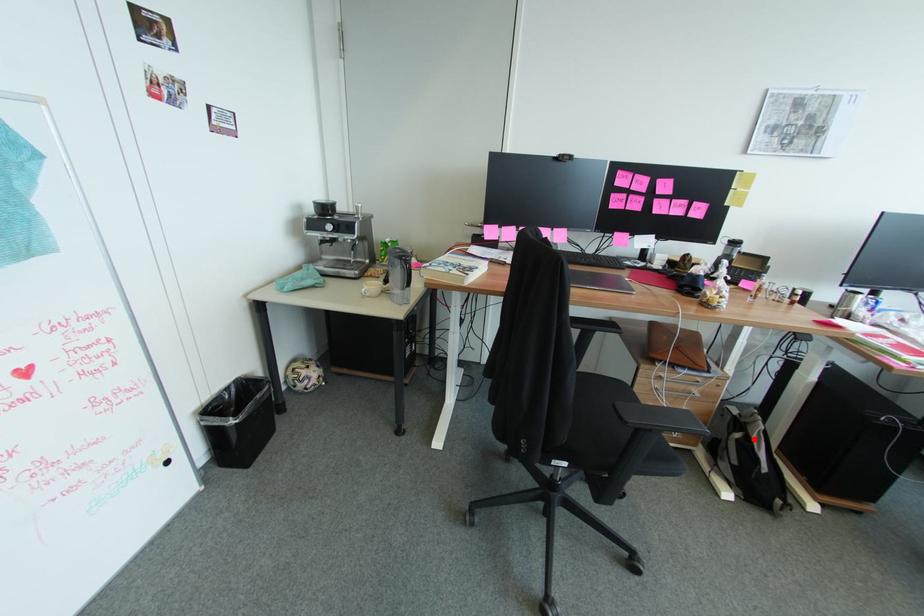
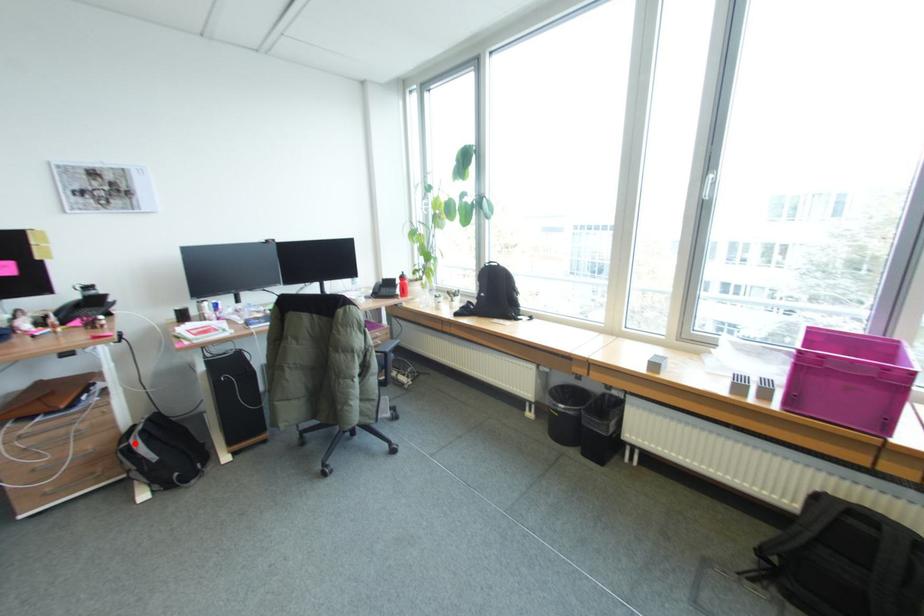
I am providing you with two images of the same scene from different viewpoints. A red point is marked on the first image and another point is marked on the second image. Is the marked point in image1 the same physical position as the marked point in image2?

Yes